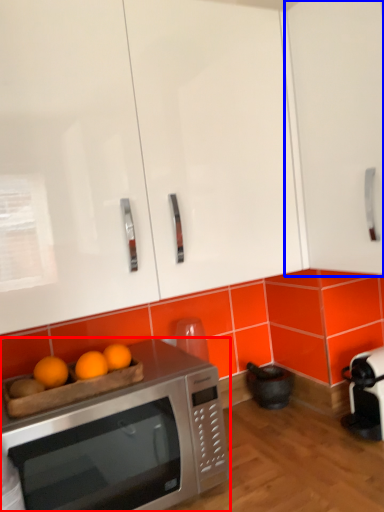
Question: Which object is closer to the camera taking this photo, microwave oven (highlighted by a red box) or cabinetry (highlighted by a blue box)?

Choices:
 (A) microwave oven
 (B) cabinetry

Answer: (A)